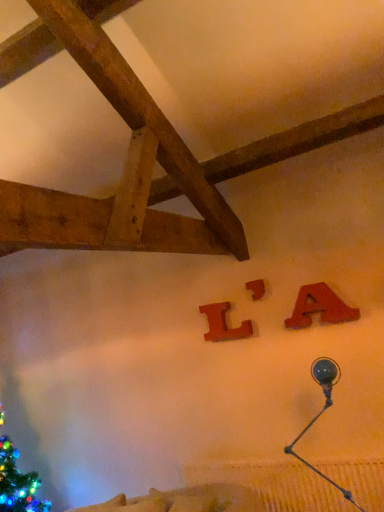
Image resolution: width=384 pixels, height=512 pixels. Describe the element at coordinates (256, 289) in the screenshot. I see `matte wood letter at center, which ranks as the second alphabet in right-to-left order` at that location.

Locate an element on the screen. matte wood letter a at upper right, the first alphabet viewed from the right is located at coordinates (319, 307).

Which object is positioned more to the left, matte wood letter a at upper right, the first alphabet viewed from the right, or metallic blue lamp at upper right?

metallic blue lamp at upper right is more to the left.

From the image's perspective, is matte wood letter a at upper right, the first alphabet viewed from the right, under metallic blue lamp at upper right?

No, from the image's perspective, matte wood letter a at upper right, the first alphabet viewed from the right, is not below metallic blue lamp at upper right.

From a real-world perspective, who is located higher, matte wood letter a at upper right, arranged as the third alphabet when viewed from the back, or metallic blue lamp at upper right?

matte wood letter a at upper right, arranged as the third alphabet when viewed from the back, from a real-world perspective.

Is metallic blue lamp at upper right completely or partially inside matte wood letter a at upper right, arranged as the third alphabet when viewed from the back?

No, matte wood letter a at upper right, arranged as the third alphabet when viewed from the back, does not contain metallic blue lamp at upper right.

Can you confirm if metallic blue lamp at upper right is shorter than matte wood letter a at upper right, the third alphabet from the left?

No, metallic blue lamp at upper right is not shorter than matte wood letter a at upper right, the third alphabet from the left.

Between metallic blue lamp at upper right and matte wood letter a at upper right, the third alphabet from the left, which one has larger size?

Bigger between the two is metallic blue lamp at upper right.

Is metallic blue lamp at upper right further to camera compared to matte wood letter a at upper right, the third alphabet from the left?

No, metallic blue lamp at upper right is closer to the camera.

Is metallic blue lamp at upper right thinner than matte wood letter a at upper right, which is the first alphabet from front to back?

Incorrect, the width of metallic blue lamp at upper right is not less than that of matte wood letter a at upper right, which is the first alphabet from front to back.

Based on their positions, is wooden letter l at center, the first alphabet from the left, located to the left or right of matte wood letter a at upper right, which is the first alphabet from front to back?

In the image, wooden letter l at center, the first alphabet from the left, appears on the left side of matte wood letter a at upper right, which is the first alphabet from front to back.

From a real-world perspective, does wooden letter l at center, the 3th alphabet positioned from the right, stand above matte wood letter a at upper right, the third alphabet from the left?

Yes, from a real-world perspective, wooden letter l at center, the 3th alphabet positioned from the right, is over matte wood letter a at upper right, the third alphabet from the left

From the wooden letter l at center, the 1th alphabet positioned from the back, count 2nd alphabet to the right and point to it. Please provide its 2D coordinates.

[(319, 307)]

Do you think wooden letter l at center, the first alphabet from the left, is within matte wood letter a at upper right, the first alphabet viewed from the right, or outside of it?

wooden letter l at center, the first alphabet from the left, is outside matte wood letter a at upper right, the first alphabet viewed from the right.

Considering the points (254, 296) and (322, 300), which point is in front, point (254, 296) or point (322, 300)?

Positioned in front is point (322, 300).

How different are the orientations of matte wood letter at center, acting as the 2th alphabet starting from the front, and matte wood letter a at upper right, the first alphabet viewed from the right, in degrees?

They differ by 0.00759 degrees in their facing directions.

Is matte wood letter at center, which ranks as the second alphabet in right-to-left order, at the right side of matte wood letter a at upper right, arranged as the third alphabet when viewed from the back?

Incorrect, matte wood letter at center, which ranks as the second alphabet in right-to-left order, is not on the right side of matte wood letter a at upper right, arranged as the third alphabet when viewed from the back.

I want to click on alphabet that is on the right side of matte wood letter at center, which appears as the second alphabet when viewed from the back, so click(319, 307).

Does matte wood letter a at upper right, the first alphabet viewed from the right, come in front of matte wood letter at center, acting as the 2th alphabet starting from the front?

Yes, matte wood letter a at upper right, the first alphabet viewed from the right, is in front of matte wood letter at center, acting as the 2th alphabet starting from the front.

Is matte wood letter a at upper right, the first alphabet viewed from the right, turned away from matte wood letter at center, acting as the 2th alphabet starting from the front?

No.

Does matte wood letter a at upper right, the first alphabet viewed from the right, have a larger size compared to matte wood letter at center, which appears as the second alphabet when viewed from the back?

Yes, matte wood letter a at upper right, the first alphabet viewed from the right, is bigger than matte wood letter at center, which appears as the second alphabet when viewed from the back.

Is matte wood letter at center, which ranks as the second alphabet in right-to-left order, not within metallic blue lamp at upper right?

Yes, matte wood letter at center, which ranks as the second alphabet in right-to-left order, is located beyond the bounds of metallic blue lamp at upper right.

Is matte wood letter at center, which appears as the second alphabet when viewed from the back, oriented away from metallic blue lamp at upper right?

No, matte wood letter at center, which appears as the second alphabet when viewed from the back, is not facing the opposite direction of metallic blue lamp at upper right.

Is matte wood letter at center, acting as the 2th alphabet starting from the front, wider or thinner than metallic blue lamp at upper right?

In the image, matte wood letter at center, acting as the 2th alphabet starting from the front, appears to be more narrow than metallic blue lamp at upper right.

Which of these two, matte wood letter at center, which ranks as the second alphabet in right-to-left order, or metallic blue lamp at upper right, stands shorter?

matte wood letter at center, which ranks as the second alphabet in right-to-left order.

Which is closer to the camera, (x=287, y=449) or (x=249, y=290)?

The point (x=287, y=449) is in front.

From a real-world perspective, between metallic blue lamp at upper right and matte wood letter at center, which ranks as the second alphabet in right-to-left order, who is vertically higher?

matte wood letter at center, which ranks as the second alphabet in right-to-left order.

Is metallic blue lamp at upper right facing towards matte wood letter at center, which ranks as the second alphabet in right-to-left order?

No, metallic blue lamp at upper right is not oriented towards matte wood letter at center, which ranks as the second alphabet in right-to-left order.

The image size is (384, 512). There is a metallic blue lamp at upper right. In order to click on the 1st alphabet above it (from a real-world perspective) in this screenshot , I will do `click(319, 307)`.

In order to click on lamp below the matte wood letter a at upper right, which is the first alphabet from front to back (from the image's perspective) in this screenshot , I will do `click(323, 412)`.

From the image, which object appears to be farther from metallic blue lamp at upper right, matte wood letter at center, acting as the 2th alphabet starting from the front, or wooden letter l at center, the 3th alphabet positioned from the right?

matte wood letter at center, acting as the 2th alphabet starting from the front, is further to metallic blue lamp at upper right.

Looking at the image, which one is located closer to matte wood letter at center, which ranks as the second alphabet in right-to-left order, metallic blue lamp at upper right or matte wood letter a at upper right, arranged as the third alphabet when viewed from the back?

matte wood letter a at upper right, arranged as the third alphabet when viewed from the back, lies closer to matte wood letter at center, which ranks as the second alphabet in right-to-left order, than the other object.

From the image, which object appears to be nearer to wooden letter l at center, the first alphabet from the left, matte wood letter at center, acting as the 2th alphabet starting from the front, or metallic blue lamp at upper right?

Among the two, matte wood letter at center, acting as the 2th alphabet starting from the front, is located nearer to wooden letter l at center, the first alphabet from the left.

When comparing their distances from wooden letter l at center, acting as the 3th alphabet starting from the front, does matte wood letter at center, which ranks as the second alphabet in right-to-left order, or matte wood letter a at upper right, which is the first alphabet from front to back, seem closer?

Among the two, matte wood letter at center, which ranks as the second alphabet in right-to-left order, is located nearer to wooden letter l at center, acting as the 3th alphabet starting from the front.

When comparing their distances from matte wood letter at center, which ranks as the second alphabet in right-to-left order, does metallic blue lamp at upper right or wooden letter l at center, the first alphabet from the left, seem closer?

Among the two, wooden letter l at center, the first alphabet from the left, is located nearer to matte wood letter at center, which ranks as the second alphabet in right-to-left order.

Looking at the image, which one is located further to metallic blue lamp at upper right, matte wood letter a at upper right, arranged as the third alphabet when viewed from the back, or wooden letter l at center, the first alphabet from the left?

Based on the image, wooden letter l at center, the first alphabet from the left, appears to be further to metallic blue lamp at upper right.

From the image, which object appears to be nearer to wooden letter l at center, acting as the 3th alphabet starting from the front, metallic blue lamp at upper right or matte wood letter at center, which appears as the second alphabet when viewed from the back?

The object closer to wooden letter l at center, acting as the 3th alphabet starting from the front, is matte wood letter at center, which appears as the second alphabet when viewed from the back.

Based on their spatial positions, is metallic blue lamp at upper right or matte wood letter a at upper right, the first alphabet viewed from the right, further from wooden letter l at center, the first alphabet from the left?

metallic blue lamp at upper right.

This screenshot has width=384, height=512. I want to click on alphabet situated between wooden letter l at center, acting as the 3th alphabet starting from the front, and matte wood letter a at upper right, which is the first alphabet from front to back, from left to right, so click(256, 289).

Locate an element on the screen. alphabet located between metallic blue lamp at upper right and matte wood letter at center, which ranks as the second alphabet in right-to-left order, in the depth direction is located at coordinates (x=319, y=307).